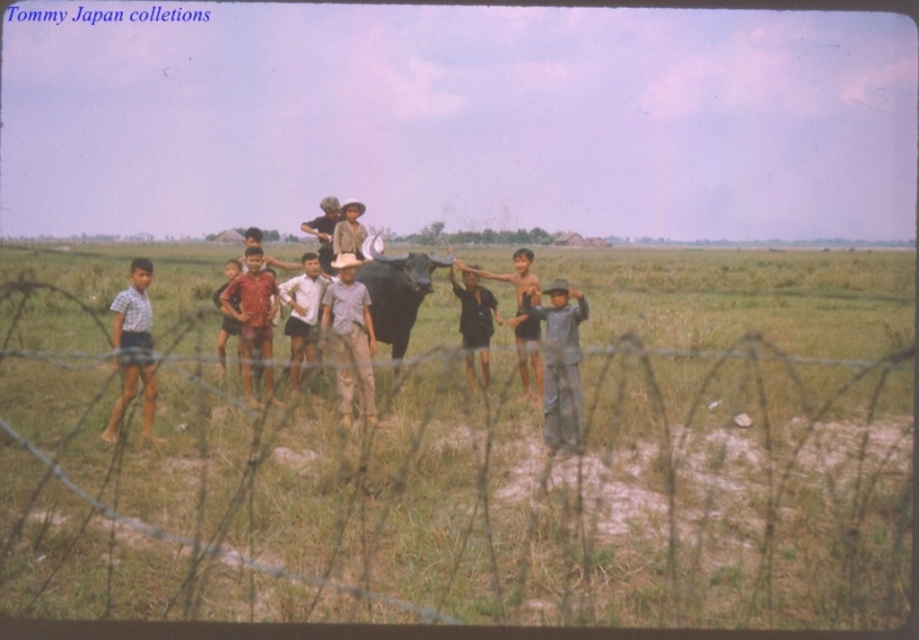
Question: Where is checkered fabric shirt at left located in relation to shiny black bull at center in the image?

Choices:
 (A) below
 (B) above

Answer: (A)

Question: Among these objects, which one is nearest to the camera?

Choices:
 (A) checkered fabric shirt at left
 (B) light brown skin at center
 (C) white cotton shirt at center

Answer: (A)

Question: Observing the image, what is the correct spatial positioning of checkered fabric shirt at left in reference to reddish-brown fabric shirt at center?

Choices:
 (A) below
 (B) above

Answer: (A)

Question: Among these objects, which one is farthest from the camera?

Choices:
 (A) checkered fabric shirt at left
 (B) light brown skin at center

Answer: (B)

Question: Does shiny black bull at center have a smaller size compared to light brown skin at center?

Choices:
 (A) no
 (B) yes

Answer: (B)

Question: Based on their relative distances, which object is farther from the barbed wire at center?

Choices:
 (A) white cotton shirt at center
 (B) shiny black bull at center
 (C) reddish-brown fabric shirt at center

Answer: (A)